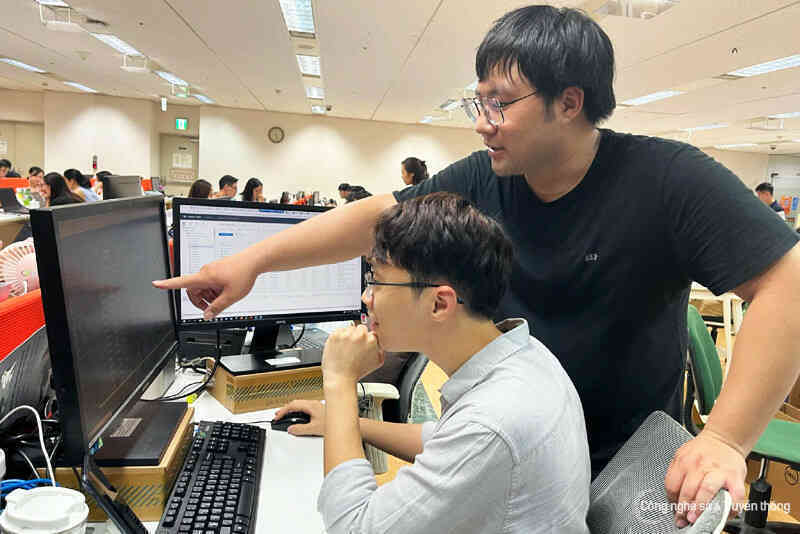
You are a GUI agent. You are given a task and a screenshot of the screen. Output one action in this format:
    pyautogui.click(x=<x>, y=<y>)
    Task: Click on the computer monitor
    
    Given the screenshot: What is the action you would take?
    pyautogui.click(x=50, y=293), pyautogui.click(x=290, y=292)